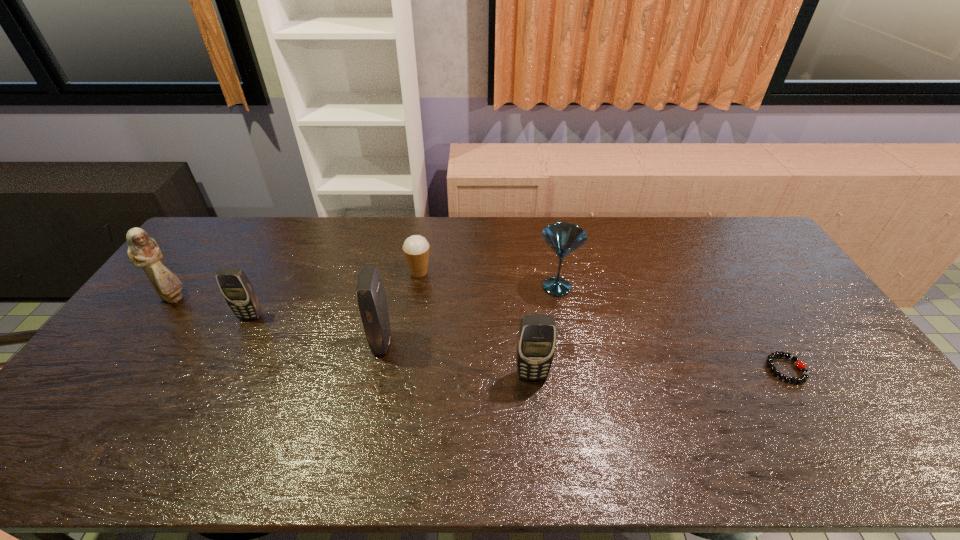
At what (x,y) coordinates should I click in order to perform the action: click on the fourth farthest object. Please return your answer as a coordinate pair (x, y). The image size is (960, 540). Looking at the image, I should click on (235, 286).

The height and width of the screenshot is (540, 960). What are the coordinates of `the second object from left to right` in the screenshot? It's located at (235, 286).

Locate an element on the screen. The height and width of the screenshot is (540, 960). the fifth object from right to left is located at coordinates (370, 291).

The image size is (960, 540). I want to click on the second cellular telephone from left to right, so click(370, 291).

Locate an element on the screen. the rightmost cellular telephone is located at coordinates (536, 340).

The image size is (960, 540). Identify the location of the nearest cellular telephone. (536, 340).

Find the location of a particular element. the second shortest object is located at coordinates (416, 248).

At what (x,y) coordinates should I click in order to perform the action: click on the fourth object from right to left. Please return your answer as a coordinate pair (x, y). Looking at the image, I should click on (416, 248).

You are a GUI agent. You are given a task and a screenshot of the screen. Output one action in this format:
    pyautogui.click(x=<x>, y=<y>)
    Task: Click on the martini
    This screenshot has width=960, height=540.
    Given the screenshot: What is the action you would take?
    pyautogui.click(x=563, y=238)

Where is `the rightmost object`? the rightmost object is located at coordinates (805, 373).